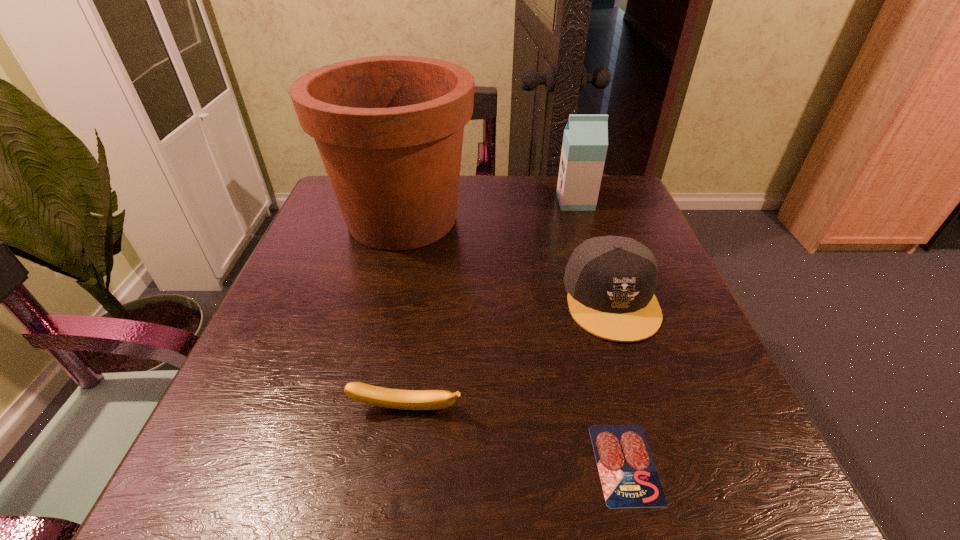
Identify the location of object that is at the far right corner. (585, 141).

Locate an element on the screen. object located at the near right corner is located at coordinates (629, 479).

The image size is (960, 540). I want to click on vacant space at the far edge, so pos(492,181).

This screenshot has height=540, width=960. In the image, there is a desktop. In order to click on vacant space at the near edge in this screenshot , I will do `click(349, 503)`.

The image size is (960, 540). Identify the location of vacant space at the left edge. (299, 289).

The image size is (960, 540). I want to click on vacant space at the right edge of the desktop, so click(x=704, y=360).

This screenshot has height=540, width=960. Identify the location of free location at the far right corner. (639, 218).

Locate an element on the screen. unoccupied area between the salami and the tallest object is located at coordinates (514, 341).

Image resolution: width=960 pixels, height=540 pixels. What are the coordinates of `vacant space in between the second tallest object and the flowerpot` in the screenshot? It's located at (489, 210).

The image size is (960, 540). What are the coordinates of `free space between the second nearest object and the tallest object` in the screenshot? It's located at (404, 314).